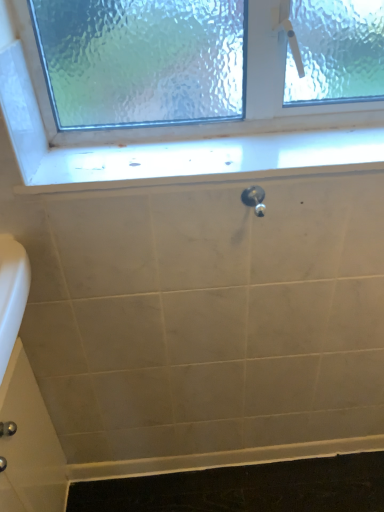
Question: From the image's perspective, is satin nickel faucet at center above or below white glossy window sill at upper center?

Choices:
 (A) above
 (B) below

Answer: (B)

Question: Is satin nickel faucet at center taller or shorter than white glossy window sill at upper center?

Choices:
 (A) tall
 (B) short

Answer: (A)

Question: In the image, is satin nickel faucet at center on the left side or the right side of white glossy window sill at upper center?

Choices:
 (A) right
 (B) left

Answer: (A)

Question: From a real-world perspective, is white glossy window sill at upper center positioned above or below satin nickel faucet at center?

Choices:
 (A) above
 (B) below

Answer: (A)

Question: Considering the positions of point (190, 168) and point (261, 214), is point (190, 168) closer or farther from the camera than point (261, 214)?

Choices:
 (A) closer
 (B) farther

Answer: (A)

Question: In terms of size, does white glossy window sill at upper center appear bigger or smaller than satin nickel faucet at center?

Choices:
 (A) big
 (B) small

Answer: (A)

Question: From the image's perspective, is white glossy window sill at upper center positioned above or below satin nickel faucet at center?

Choices:
 (A) below
 (B) above

Answer: (B)